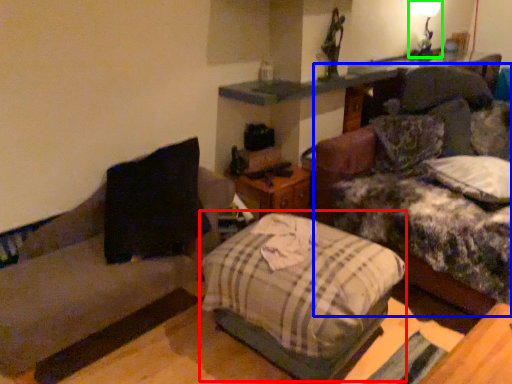
Question: Estimate the real-world distances between objects in this image. Which object is farther from bed (highlighted by a red box), couch (highlighted by a blue box) or light fixture (highlighted by a green box)?

Choices:
 (A) couch
 (B) light fixture

Answer: (B)